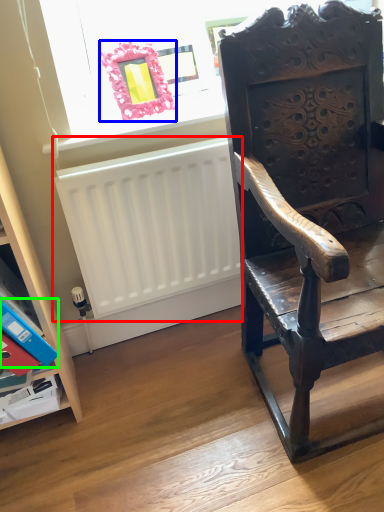
Question: Which object is the farthest from radiator (highlighted by a red box)? Choose among these: picture frame (highlighted by a blue box) or paperback book (highlighted by a green box).

Choices:
 (A) picture frame
 (B) paperback book

Answer: (B)